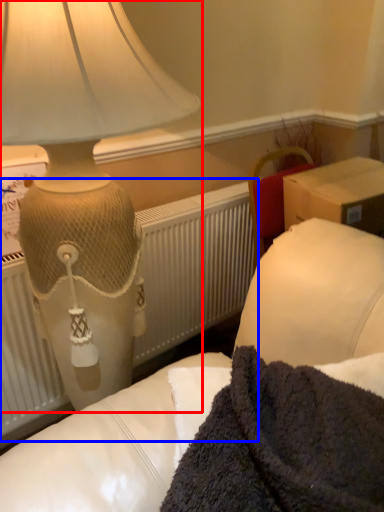
Question: Which point is closer to the camera, lamp (highlighted by a red box) or radiator (highlighted by a blue box)?

Choices:
 (A) lamp
 (B) radiator

Answer: (A)